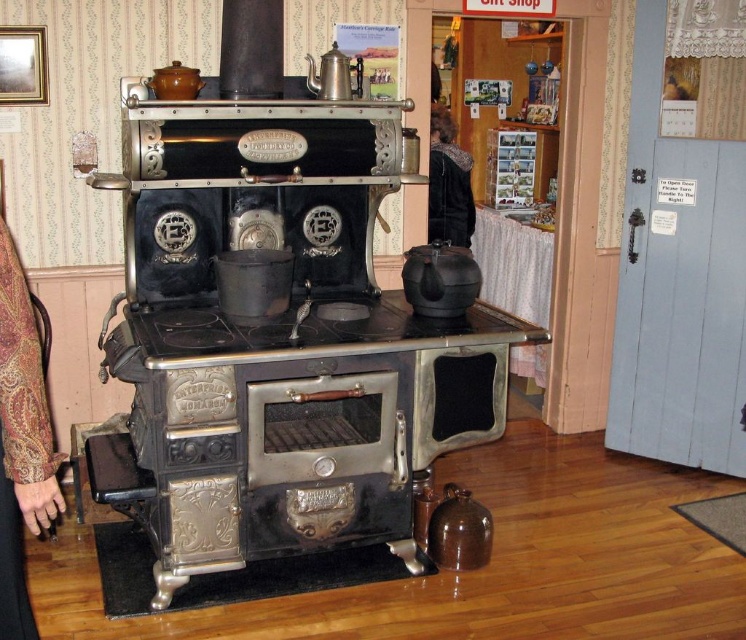
In the scene shown: You are standing in front of the vintage cast iron stove and want to reach both the point at (413, 353) and the point at (436, 160). Which point will require you to move further back to reach?

The point at (436, 160) is further away from you than the point at (413, 353), so you will need to move further back to reach it.

You are standing in front of the black cast iron stove at center. If you want to take a photo of it from a distance that is exactly 7.5 feet away, will you need to move closer or farther away?

The black cast iron stove at center is 7.49 feet from camera, so you need to move slightly farther away to reach exactly 7.5 feet.

What are the coordinates of the black cast iron stove at center?

The coordinates of the black cast iron stove at center are at point (280, 339).